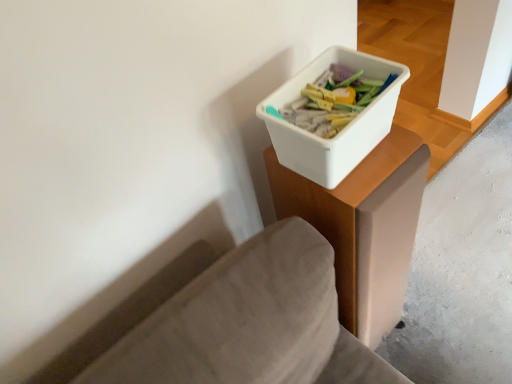
Question: In terms of height, does smooth concrete at lower right look taller or shorter compared to white plastic container at upper right?

Choices:
 (A) short
 (B) tall

Answer: (A)

Question: Looking at the image, does smooth concrete at lower right seem bigger or smaller compared to white plastic container at upper right?

Choices:
 (A) big
 (B) small

Answer: (B)

Question: Estimate the real-world distances between objects in this image. Which object is farther from the smooth concrete at lower right?

Choices:
 (A) white plastic container at upper right
 (B) white plastic container at upper right

Answer: (B)

Question: Which is nearer to the smooth concrete at lower right?

Choices:
 (A) white plastic container at upper right
 (B) white plastic container at upper right

Answer: (A)